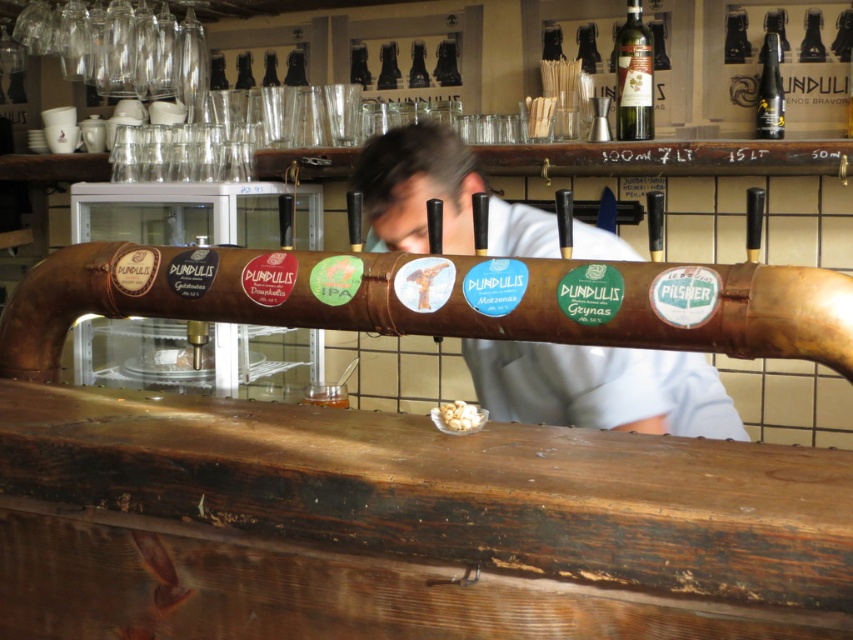
Does white fabric shirt at center appear under green glass bottle at upper right?

Indeed, white fabric shirt at center is positioned under green glass bottle at upper right.

Image resolution: width=853 pixels, height=640 pixels. Find the location of `white fabric shirt at center`. white fabric shirt at center is located at coordinates (601, 388).

Between green glass bottle at upper right and shiny dark glass bottle at upper right, which one has more height?

green glass bottle at upper right

Is green glass bottle at upper right thinner than shiny dark glass bottle at upper right?

No.

Between point (624, 49) and point (769, 68), which one is positioned behind?

Positioned behind is point (769, 68).

Where is `green glass bottle at upper right`? This screenshot has height=640, width=853. green glass bottle at upper right is located at coordinates (633, 76).

Measure the distance between point (489, 365) and camera.

The distance of point (489, 365) from camera is 5.20 feet.

Is white fabric shirt at center below shiny dark glass bottle at upper right?

Correct, white fabric shirt at center is located below shiny dark glass bottle at upper right.

Between point (375, 220) and point (775, 80), which one is positioned behind?

The point (775, 80) is more distant.

Image resolution: width=853 pixels, height=640 pixels. Find the location of `white fabric shirt at center`. white fabric shirt at center is located at coordinates (601, 388).